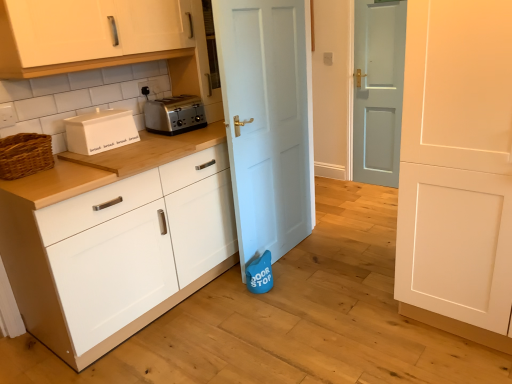
Find the location of a particular element. The image size is (512, 384). vacant space to the right of white matte cabinet at center, which appears as the second cabinetry when viewed from the top is located at coordinates (332, 295).